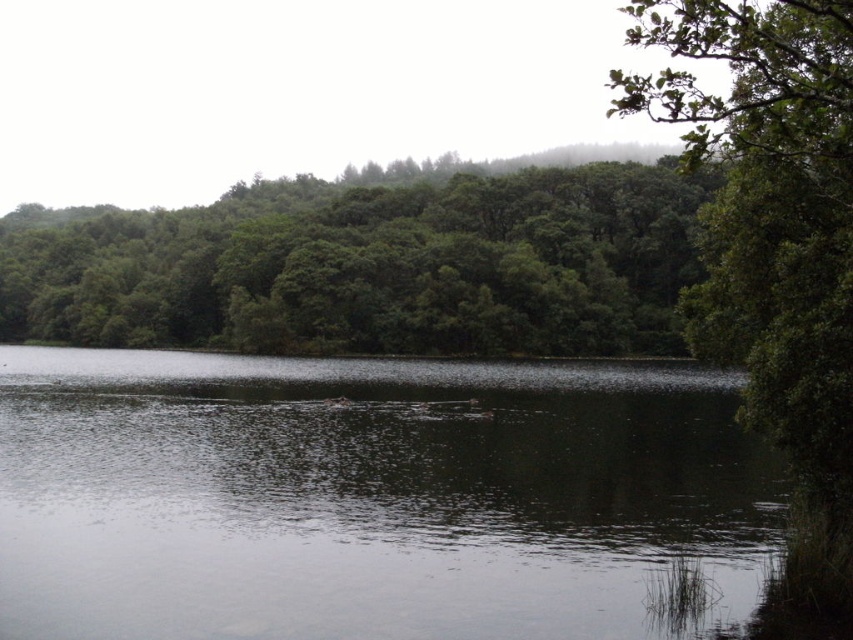
You are standing at the edge of the water and see both the dark reflective water at center and the green leafy trees at center. Which object is positioned to the right of the other?

The dark reflective water at center is to the right of the green leafy trees at center.

You are standing on the edge of the lake and notice the dark reflective water at center and the green leafy trees at center. Which object takes up less space in the image?

The dark reflective water at center takes up less space in the image compared to the green leafy trees at center, as it has a smaller size.

You are standing at the edge of the lake and notice the dark reflective water at center and the green leafy trees at center. Which object is positioned lower in the scene?

The dark reflective water at center is located below the green leafy trees at center, so it is positioned lower in the scene.